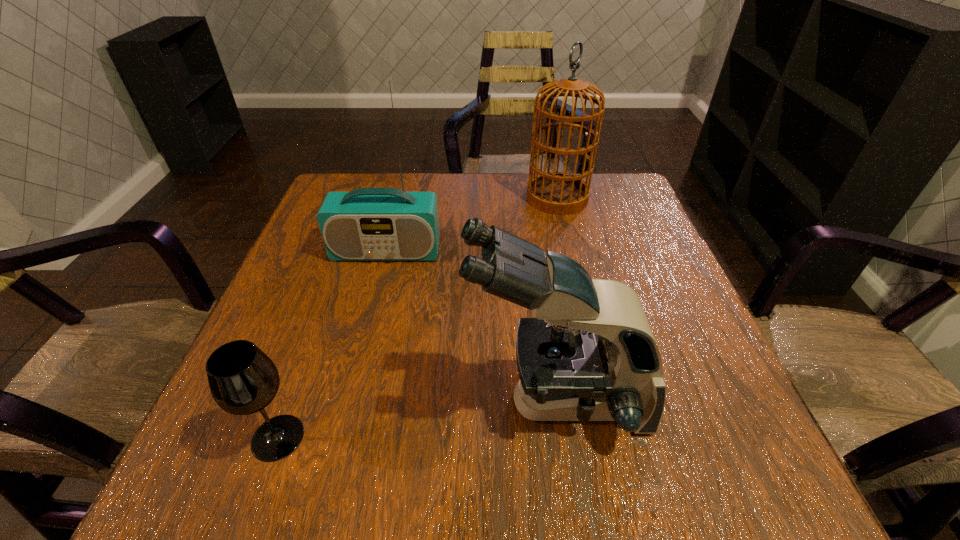
Locate an element on the screen. The height and width of the screenshot is (540, 960). birdcage is located at coordinates (561, 193).

The width and height of the screenshot is (960, 540). In order to click on the third nearest object in this screenshot , I will do `click(366, 224)`.

You are a GUI agent. You are given a task and a screenshot of the screen. Output one action in this format:
    pyautogui.click(x=<x>, y=<y>)
    Task: Click on the microscope
    The width and height of the screenshot is (960, 540).
    Given the screenshot: What is the action you would take?
    pyautogui.click(x=589, y=355)

Where is `the shortest object`? the shortest object is located at coordinates (243, 380).

The width and height of the screenshot is (960, 540). What are the coordinates of `vacant area located on the front of the birdcage` in the screenshot? It's located at (579, 286).

Locate an element on the screen. This screenshot has height=540, width=960. free space located on the front panel of the second farthest object is located at coordinates (357, 367).

This screenshot has height=540, width=960. What are the coordinates of `free point located 0.310m through the eyepieces of the microscope` in the screenshot? It's located at (280, 400).

This screenshot has width=960, height=540. Identify the location of vacant space positioned through the eyepieces of the microscope. (346, 400).

I want to click on blank area located 0.120m through the eyepieces of the microscope, so click(x=394, y=400).

Identify the location of vacant space located 0.090m on the back of the wineglass. (302, 368).